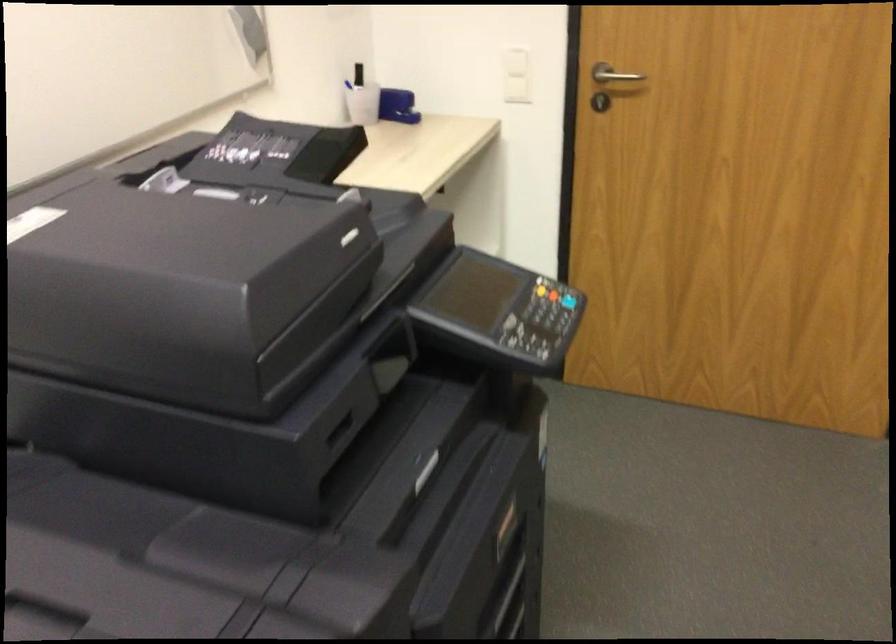
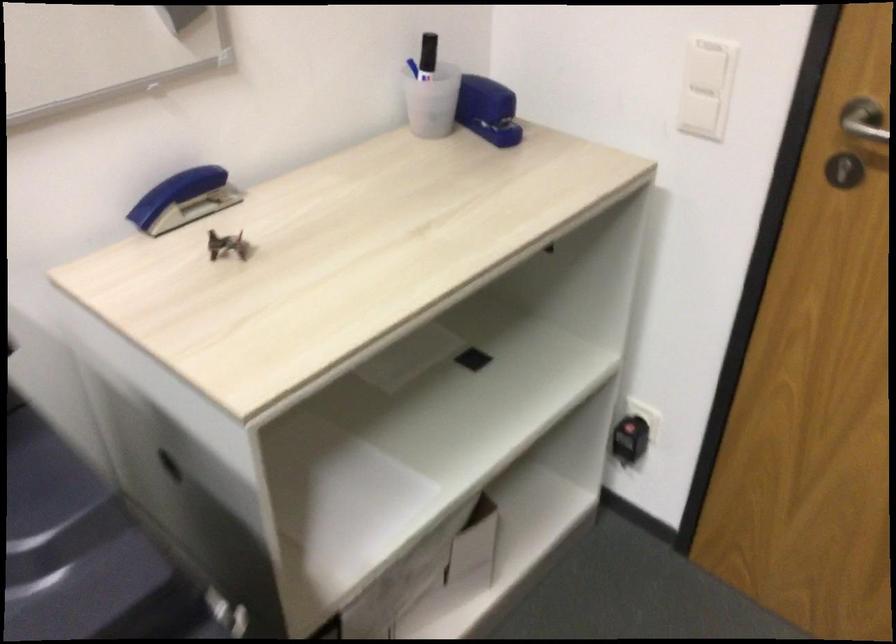
Question: Which direction would the cameraman need to move to produce the second image? Reply with the corresponding letter.

Choices:
 (A) Left
 (B) Right
 (C) Forward
 (D) Backward

Answer: (C)